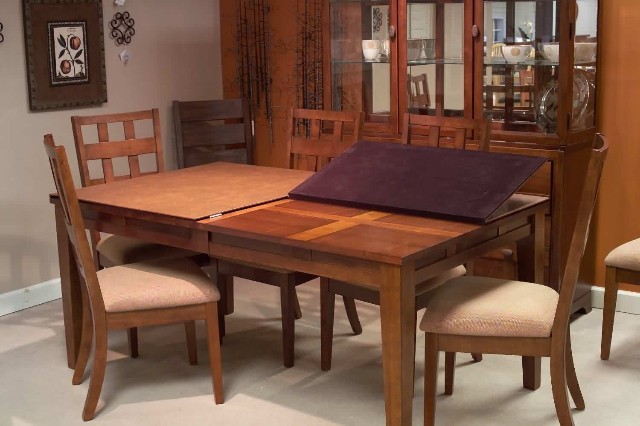
Where is `chair back`? chair back is located at coordinates (50, 154), (118, 114), (310, 112), (431, 119), (603, 143).